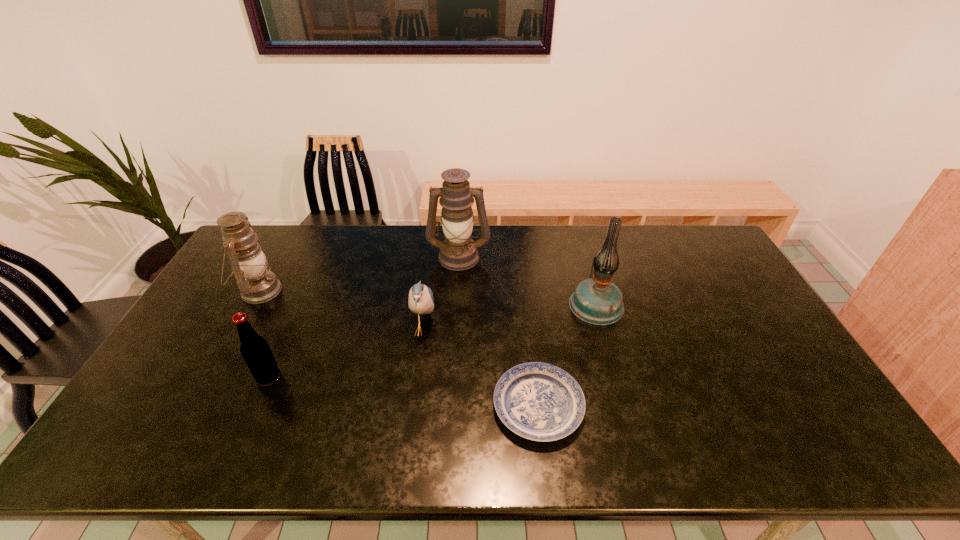
Image resolution: width=960 pixels, height=540 pixels. Find the location of `vacant space at the far right corner of the desktop`. vacant space at the far right corner of the desktop is located at coordinates (695, 227).

Find the location of a particular element. This screenshot has width=960, height=540. vacant space at the near right corner of the desktop is located at coordinates (807, 463).

You are a GUI agent. You are given a task and a screenshot of the screen. Output one action in this format:
    pyautogui.click(x=<x>, y=<y>)
    Task: Click on the free area in between the rightmost oil lamp and the bird
    The height and width of the screenshot is (540, 960).
    Given the screenshot: What is the action you would take?
    (510, 316)

I want to click on empty location between the fourth tallest object and the farthest oil lamp, so click(364, 316).

This screenshot has width=960, height=540. What are the coordinates of `unoccupied area between the farthest object and the rightmost object` in the screenshot? It's located at (527, 280).

Where is `free point between the leftmost object and the second oil lamp from left to right`? free point between the leftmost object and the second oil lamp from left to right is located at coordinates (359, 273).

You are a GUI agent. You are given a task and a screenshot of the screen. Output one action in this format:
    pyautogui.click(x=<x>, y=<y>)
    Task: Click on the free spot between the rightmost object and the farthest object
    The height and width of the screenshot is (540, 960).
    Given the screenshot: What is the action you would take?
    pyautogui.click(x=527, y=280)

The height and width of the screenshot is (540, 960). Identify the location of free area in between the second oil lamp from right to left and the second shortest object. point(442,293).

This screenshot has width=960, height=540. Find the location of `vacant space that is in between the second oil lamp from left to right and the bird`. vacant space that is in between the second oil lamp from left to right and the bird is located at coordinates (442, 293).

Where is `vacant area that lies between the leftmost object and the farthest object`? vacant area that lies between the leftmost object and the farthest object is located at coordinates (359, 273).